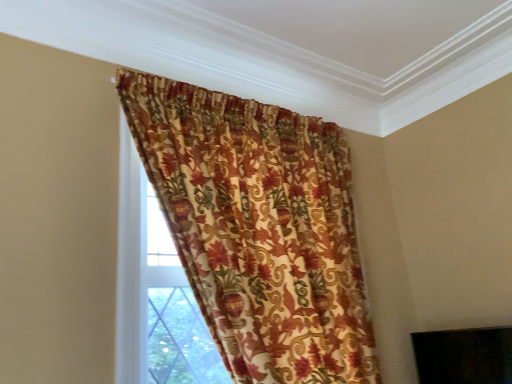
Find the location of a particular element. The height and width of the screenshot is (384, 512). floral-patterned fabric at upper center is located at coordinates (258, 229).

What do you see at coordinates (258, 229) in the screenshot? The image size is (512, 384). I see `floral-patterned fabric at upper center` at bounding box center [258, 229].

Identify the location of floral-patterned fabric at upper center. Image resolution: width=512 pixels, height=384 pixels. (258, 229).